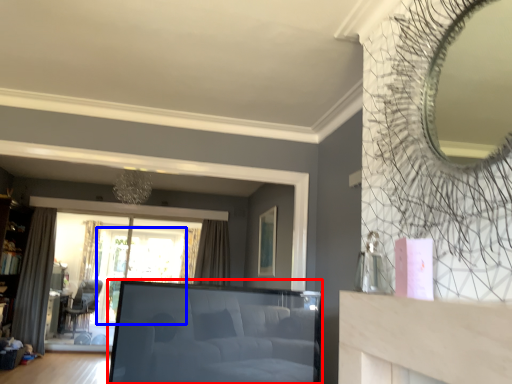
Question: Among these objects, which one is farthest to the camera, studio couch (highlighted by a red box) or window screen (highlighted by a blue box)?

Choices:
 (A) studio couch
 (B) window screen

Answer: (B)